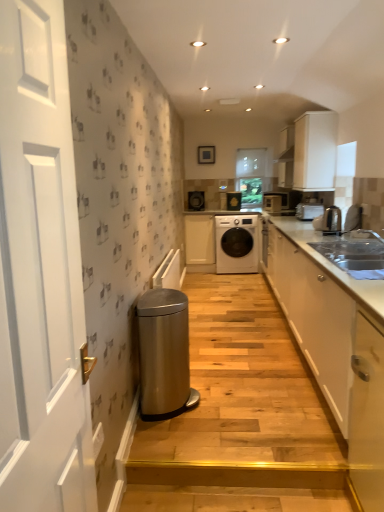
Question: Is wooden step at lower center, arranged as the first stairwell when ordered from the bottom, to the left or to the right of white glossy cabinet at right, the 3th cabinetry in the back-to-front sequence, in the image?

Choices:
 (A) left
 (B) right

Answer: (A)

Question: Is point (314, 502) closer or farther from the camera than point (340, 408)?

Choices:
 (A) closer
 (B) farther

Answer: (A)

Question: Which of these objects is positioned closest to the wooden step at lower center, arranged as the first stairwell when ordered from the bottom?

Choices:
 (A) black glossy washing machine at center, which appears as the fourth appliance when viewed from the right
 (B) silver metallic sink at right
 (C) white wooden door at left
 (D) white glossy cabinet at right, the 3th cabinetry in the back-to-front sequence
 (E) white matte cabinet at upper right, the first cabinetry in the right-to-left sequence

Answer: (D)

Question: Estimate the real-world distances between objects in this image. Which object is farther from the transparent glass window at center?

Choices:
 (A) wooden step at lower center, which is counted as the 2th stairwell, starting from the back
 (B) white matte cabinet at upper right, acting as the second cabinetry starting from the back
 (C) white glossy cabinet at right, the 2th cabinetry viewed from the front
 (D) white matte washing machine at center
 (E) satin metallic toaster at right, which is counted as the third appliance, starting from the right

Answer: (A)